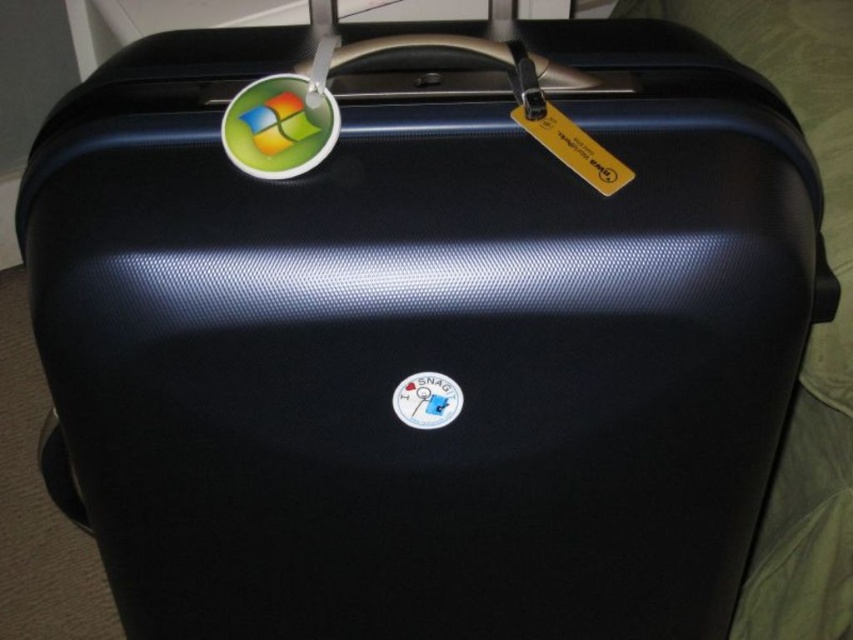
You are packing for a trip and need to attach an important label to your black suitcase. You have two options on the suitcase already attached. Which one is closer to you, the yellow paper tag at upper center or the white matte sticker at center?

The yellow paper tag at upper center is closer to you because it is in front of the white matte sticker at center.

You are packing for a trip and need to attach a new luggage tag to your black suitcase. You have two stickers available, the shiny plastic sticker at top left and the white matte sticker at center. Which sticker should you place the new luggage tag on to ensure it is visible from the front?

You should place the new luggage tag on the white matte sticker at center because the shiny plastic sticker at top left is in front of it, so the new tag on the white matte sticker at center would be partially hidden behind the shiny plastic sticker at top left.